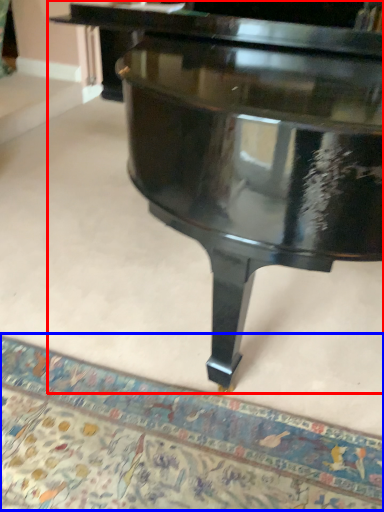
Question: Which object appears closest to the camera in this image, piano (highlighted by a red box) or mat (highlighted by a blue box)?

Choices:
 (A) piano
 (B) mat

Answer: (A)